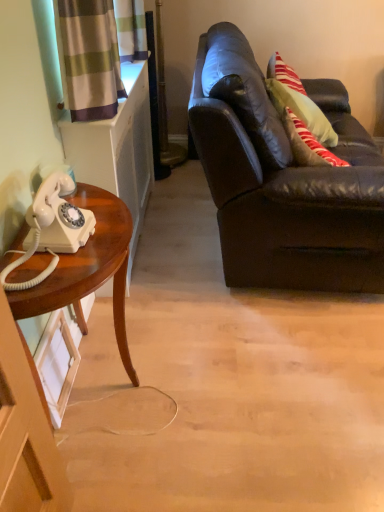
Question: Should I look upward or downward to see white glossy corded phone at left?

Choices:
 (A) down
 (B) up

Answer: (B)

Question: Does white glossy corded phone at left have a greater width compared to matte black leather couch at right?

Choices:
 (A) no
 (B) yes

Answer: (A)

Question: Is white glossy corded phone at left outside of matte black leather couch at right?

Choices:
 (A) yes
 (B) no

Answer: (A)

Question: Does white glossy corded phone at left have a greater height compared to matte black leather couch at right?

Choices:
 (A) yes
 (B) no

Answer: (B)

Question: Considering the relative sizes of white glossy corded phone at left and matte black leather couch at right in the image provided, is white glossy corded phone at left shorter than matte black leather couch at right?

Choices:
 (A) yes
 (B) no

Answer: (A)

Question: Does white glossy corded phone at left touch matte black leather couch at right?

Choices:
 (A) yes
 (B) no

Answer: (B)

Question: From a real-world perspective, is white glossy corded phone at left physically below matte black leather couch at right?

Choices:
 (A) yes
 (B) no

Answer: (B)

Question: Is wooden desk at left outside white glossy corded phone at left?

Choices:
 (A) no
 (B) yes

Answer: (B)

Question: From the image's perspective, is wooden desk at left above white glossy corded phone at left?

Choices:
 (A) no
 (B) yes

Answer: (A)

Question: Could you tell me if wooden desk at left is turned towards white glossy corded phone at left?

Choices:
 (A) yes
 (B) no

Answer: (B)

Question: From a real-world perspective, is wooden desk at left located beneath white glossy corded phone at left?

Choices:
 (A) yes
 (B) no

Answer: (A)

Question: Is wooden desk at left closer to the viewer compared to white glossy corded phone at left?

Choices:
 (A) yes
 (B) no

Answer: (B)

Question: From the image's perspective, is wooden desk at left located beneath white glossy corded phone at left?

Choices:
 (A) no
 (B) yes

Answer: (B)

Question: Is matte black leather couch at right shorter than wooden desk at left?

Choices:
 (A) no
 (B) yes

Answer: (A)